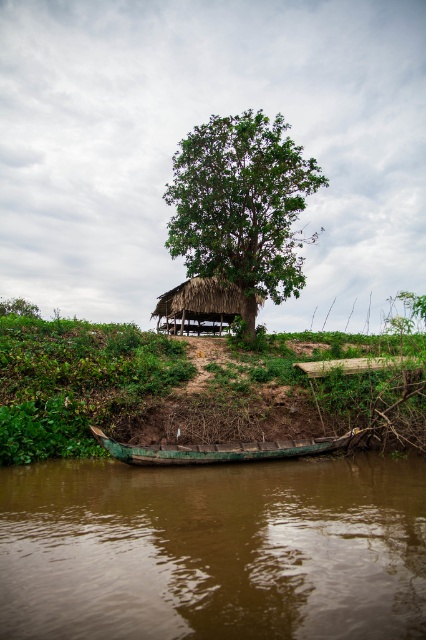
Consider the image. You are standing on the riverbank and want to cross to the other side. The brown muddy water at lower center and the green leafy tree at center are in your line of sight. Which object is closer to the ground?

The brown muddy water at lower center is shorter than the green leafy tree at center, so the brown muddy water at lower center is closer to the ground.

You are standing at the origin point of the image. Which direction should you move to reach the green wooden boat at lower center?

The green wooden boat at lower center is located at coordinates 0.703 on the x axis and 0.516 on the y axis. Since you are at the origin point, you should move towards the right and slightly upwards to reach it.

You are a painter setting up your easel to capture the riverside scene. You want to ensure both the green wooden boat at lower center and the green leafy tree at lower left are visible in your painting. Given their sizes, which object should you place closer to the center of your canvas to maintain balance?

The green wooden boat at lower center is smaller than the green leafy tree at lower left, so to maintain balance in the painting, the boat should be placed closer to the center of the canvas to compensate for its smaller size compared to the tree.